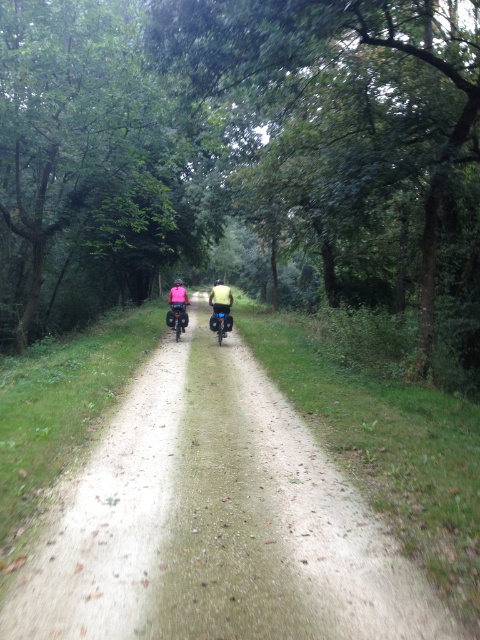
Question: From the image, what is the correct spatial relationship of yellow-green fabric shirt at center in relation to pink fabric jacket at center?

Choices:
 (A) above
 (B) below

Answer: (A)

Question: Does green leafy tree at center appear under pink fabric jacket at center?

Choices:
 (A) yes
 (B) no

Answer: (B)

Question: Estimate the real-world distances between objects in this image. Which object is farther from the dirt path at center?

Choices:
 (A) yellow-green fabric shirt at center
 (B) green leafy tree at center

Answer: (B)

Question: Which point is closer to the camera taking this photo?

Choices:
 (A) (180, 314)
 (B) (153, 372)
 (C) (228, 321)
 (D) (250, 93)

Answer: (B)

Question: Does green leafy tree at center have a lesser width compared to pink fabric jacket at center?

Choices:
 (A) yes
 (B) no

Answer: (B)

Question: Which point appears closest to the camera in this image?

Choices:
 (A) (445, 138)
 (B) (216, 289)

Answer: (A)